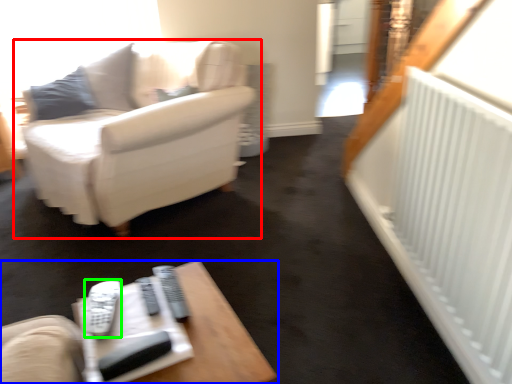
Question: Which object is positioned closest to studio couch (highlighted by a red box)? Select from table (highlighted by a blue box) and remote (highlighted by a green box).

Choices:
 (A) table
 (B) remote

Answer: (B)